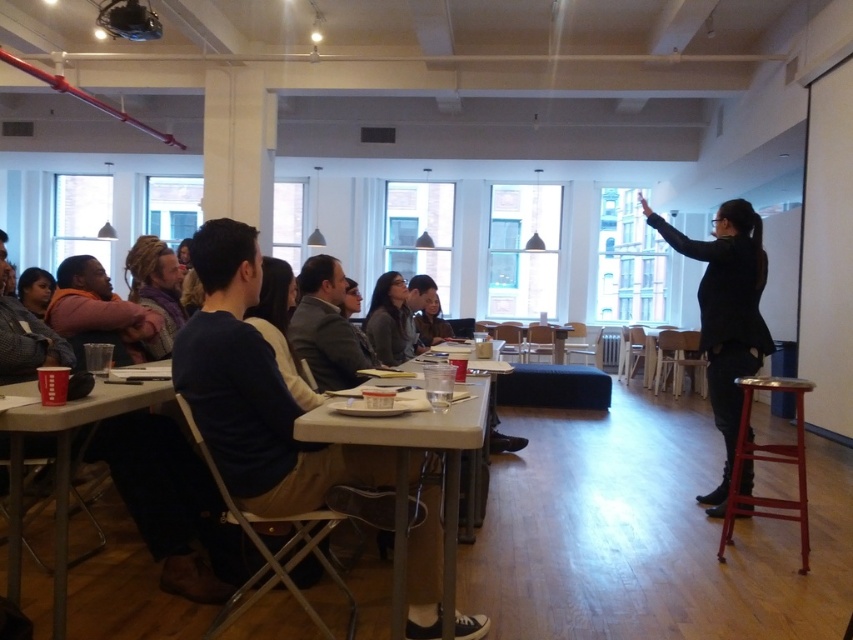
Question: Can you confirm if black leather jacket at upper right is positioned to the left of smooth plastic table at center?

Choices:
 (A) no
 (B) yes

Answer: (A)

Question: Which point is farther from the camera taking this photo?

Choices:
 (A) (701, 256)
 (B) (152, 308)

Answer: (A)

Question: Among these points, which one is nearest to the camera?

Choices:
 (A) (398, 291)
 (B) (462, 534)

Answer: (B)

Question: Which object is farther from the camera taking this photo?

Choices:
 (A) matte plastic cup at lower left
 (B) white plastic table at center
 (C) matte gray sweater at center

Answer: (C)

Question: Does matte purple scarf at center appear on the right side of matte black jacket at center?

Choices:
 (A) yes
 (B) no

Answer: (B)

Question: Is black leather jacket at upper right to the right of red metal stool at lower right from the viewer's perspective?

Choices:
 (A) no
 (B) yes

Answer: (A)